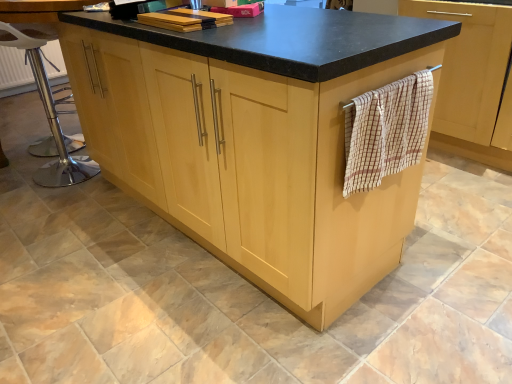
At what (x,y) coordinates should I click in order to perform the action: click on vacant space that is to the left of polished chrome bar stool at left. Please return your answer as a coordinate pair (x, y). The image size is (512, 384). Looking at the image, I should click on (18, 171).